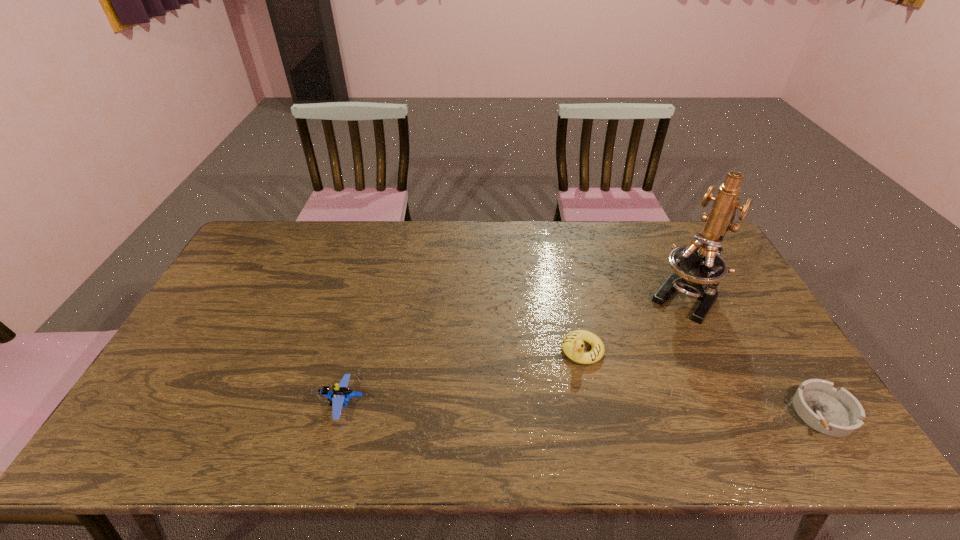
Where is `free area in between the rightmost object and the tallest object`? free area in between the rightmost object and the tallest object is located at coordinates (755, 354).

This screenshot has height=540, width=960. I want to click on free spot between the leftmost object and the ashtray, so click(x=584, y=408).

Where is `vacant space that's between the duckling and the microscope`? The height and width of the screenshot is (540, 960). vacant space that's between the duckling and the microscope is located at coordinates (634, 322).

Locate an element on the screen. empty location between the rightmost object and the second object from right to left is located at coordinates (755, 354).

Image resolution: width=960 pixels, height=540 pixels. I want to click on empty space between the Lego and the third object from left to right, so click(515, 350).

At what (x,y) coordinates should I click in order to perform the action: click on free point between the leftmost object and the ashtray. Please return your answer as a coordinate pair (x, y). Looking at the image, I should click on (584, 408).

Where is `empty space between the shortest object and the farthest object`? empty space between the shortest object and the farthest object is located at coordinates (755, 354).

You are a GUI agent. You are given a task and a screenshot of the screen. Output one action in this format:
    pyautogui.click(x=<x>, y=<y>)
    Task: Click on the object that is the second closest to the third object from right to left
    
    Given the screenshot: What is the action you would take?
    pyautogui.click(x=837, y=413)

Identify the location of object that stands as the third closest to the third object from left to right. The image size is (960, 540). (338, 398).